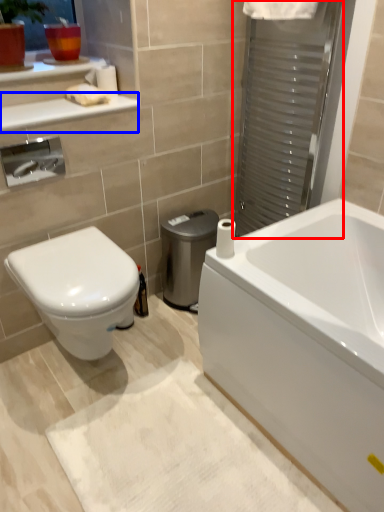
Question: Which point is further to the camera, screen door (highlighted by a red box) or balustrade (highlighted by a blue box)?

Choices:
 (A) screen door
 (B) balustrade

Answer: (A)